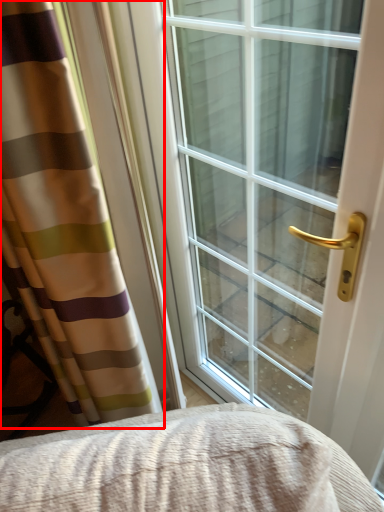
Question: From the image's perspective, considering the relative positions of curtain (annotated by the red box) and window in the image provided, where is curtain (annotated by the red box) located with respect to the staircase?

Choices:
 (A) above
 (B) below

Answer: (B)